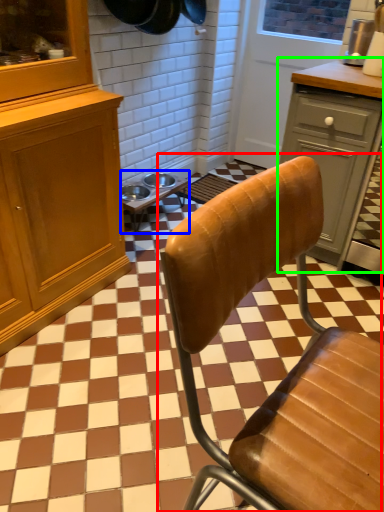
Question: Which is nearer to the chair (highlighted by a red box)? table (highlighted by a blue box) or cabinetry (highlighted by a green box).

Choices:
 (A) table
 (B) cabinetry

Answer: (B)